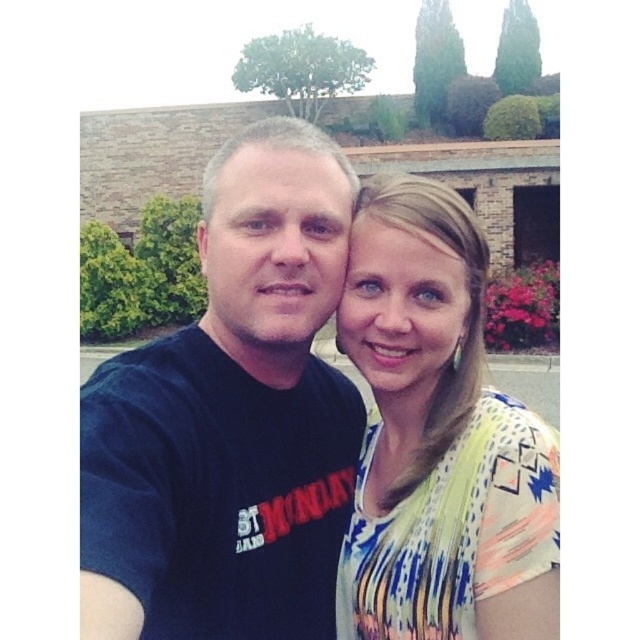
Question: Is dark blue t-shirt at center positioned before multicolored printed blouse at center?

Choices:
 (A) no
 (B) yes

Answer: (B)

Question: Which point is closer to the camera?

Choices:
 (A) (460, 616)
 (B) (205, 371)

Answer: (A)

Question: Which of the following is the farthest from the observer?

Choices:
 (A) (472, 545)
 (B) (256, 490)

Answer: (B)

Question: Is dark blue t-shirt at center to the left of multicolored printed blouse at center from the viewer's perspective?

Choices:
 (A) no
 (B) yes

Answer: (B)

Question: Is dark blue t-shirt at center to the right of multicolored printed blouse at center from the viewer's perspective?

Choices:
 (A) yes
 (B) no

Answer: (B)